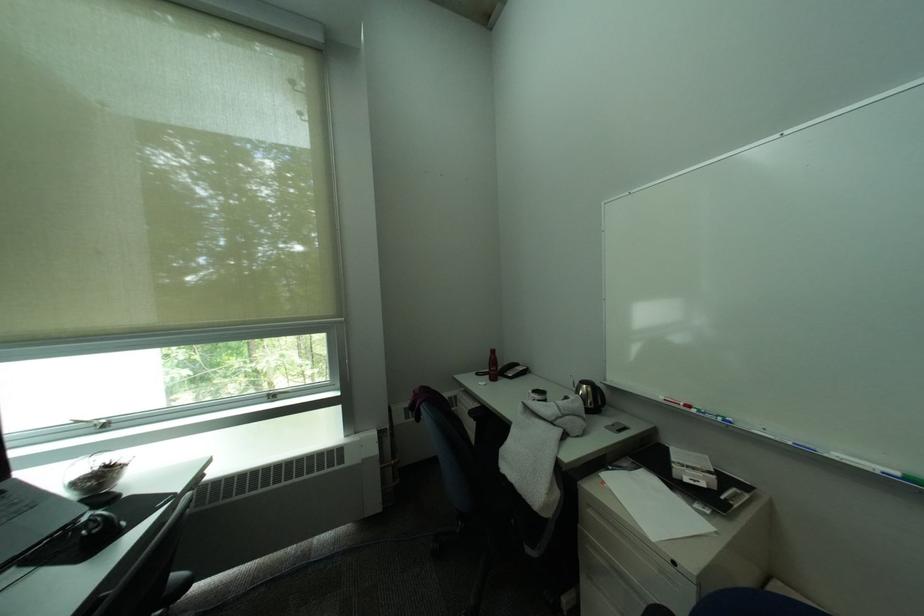
Where would you lift the telephone handset? Please return your answer as a coordinate pair (x, y).

(513, 370)